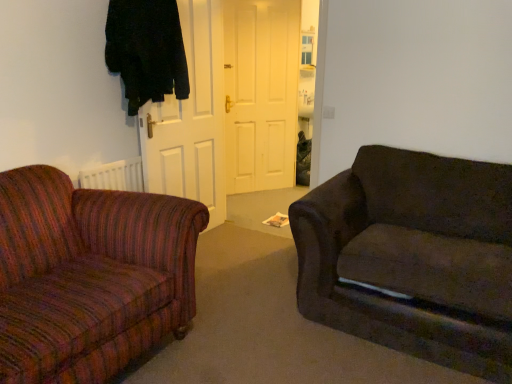
Where is `free region on the left part of dark fabric couch at right`? This screenshot has width=512, height=384. free region on the left part of dark fabric couch at right is located at coordinates (229, 302).